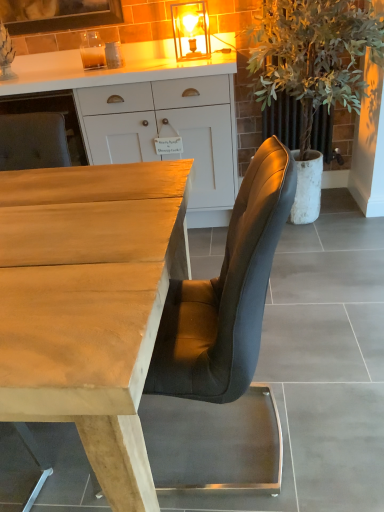
Question: Would you say green leafy plant at right is outside light brown wood desk at center?

Choices:
 (A) yes
 (B) no

Answer: (A)

Question: Is green leafy plant at right closer to camera compared to light brown wood desk at center?

Choices:
 (A) yes
 (B) no

Answer: (B)

Question: Is green leafy plant at right looking in the opposite direction of light brown wood desk at center?

Choices:
 (A) yes
 (B) no

Answer: (B)

Question: Is green leafy plant at right behind light brown wood desk at center?

Choices:
 (A) no
 (B) yes

Answer: (B)

Question: From a real-world perspective, is green leafy plant at right on top of light brown wood desk at center?

Choices:
 (A) no
 (B) yes

Answer: (B)

Question: Is light brown wood desk at center a part of green leafy plant at right?

Choices:
 (A) yes
 (B) no

Answer: (B)

Question: From the image's perspective, would you say green leafy plant at right is shown under white wood cabinet at upper center?

Choices:
 (A) yes
 (B) no

Answer: (B)

Question: Is green leafy plant at right at the left side of white wood cabinet at upper center?

Choices:
 (A) yes
 (B) no

Answer: (B)

Question: Can you confirm if green leafy plant at right is taller than white wood cabinet at upper center?

Choices:
 (A) yes
 (B) no

Answer: (A)

Question: From a real-world perspective, is green leafy plant at right located higher than white wood cabinet at upper center?

Choices:
 (A) no
 (B) yes

Answer: (B)

Question: Is green leafy plant at right positioned with its back to white wood cabinet at upper center?

Choices:
 (A) no
 (B) yes

Answer: (A)

Question: Can you see green leafy plant at right touching white wood cabinet at upper center?

Choices:
 (A) no
 (B) yes

Answer: (A)

Question: Would you consider matte glass lampshade at upper center to be distant from light brown wood desk at center?

Choices:
 (A) no
 (B) yes

Answer: (B)